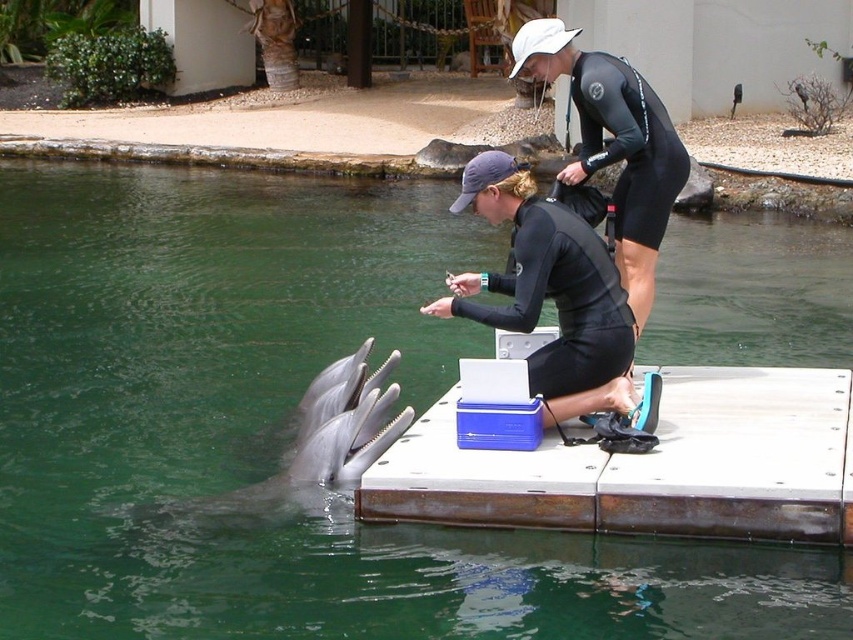
Can you confirm if black matte wetsuit at center is thinner than gray smooth dolphin at lower left?

Correct, black matte wetsuit at center's width is less than gray smooth dolphin at lower left's.

Is point (608, 355) farther from viewer compared to point (233, 513)?

No, it is not.

Is point (544, 262) behind point (262, 493)?

No, (544, 262) is in front of (262, 493).

The width and height of the screenshot is (853, 640). I want to click on black matte wetsuit at center, so click(556, 298).

Does point (804, 376) come closer to viewer compared to point (363, 440)?

No.

Does white wood dock at center appear under gray smooth dolphin at lower left?

No.

Which is in front, point (654, 531) or point (396, 432)?

Point (654, 531) is in front.

Locate an element on the screen. white wood dock at center is located at coordinates (648, 465).

Is gray smooth dolphin at lower left wider than black matte wetsuit at upper center?

Yes, gray smooth dolphin at lower left is wider than black matte wetsuit at upper center.

Which is below, gray smooth dolphin at lower left or black matte wetsuit at upper center?

Answer: gray smooth dolphin at lower left

Is point (241, 515) in front of point (648, 116)?

Yes, it is in front of point (648, 116).

Locate an element on the screen. The width and height of the screenshot is (853, 640). gray smooth dolphin at lower left is located at coordinates (318, 444).